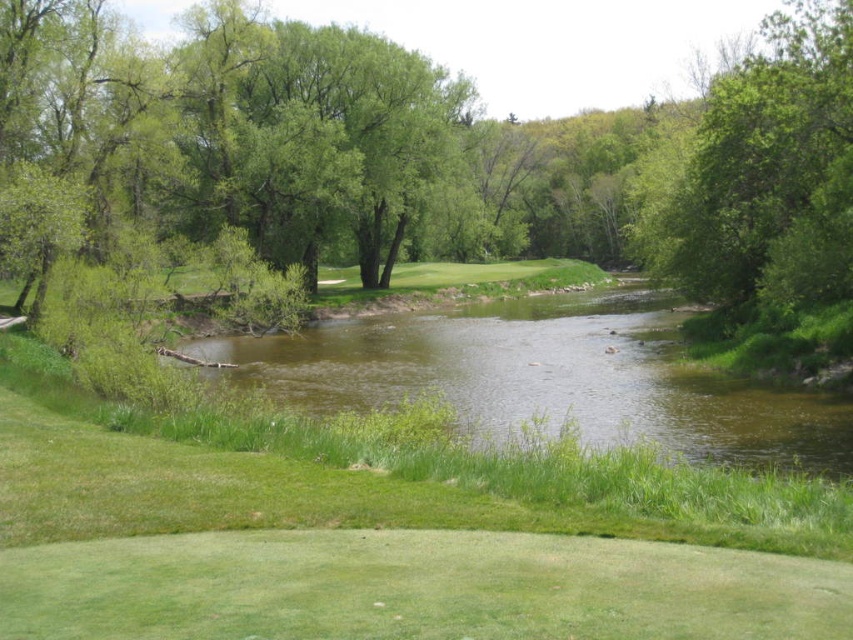
Question: Does green grassy golf course at center lie behind green leafy tree at upper right?

Choices:
 (A) no
 (B) yes

Answer: (A)

Question: Does green grassy golf course at center come in front of green leafy tree at upper right?

Choices:
 (A) no
 (B) yes

Answer: (B)

Question: Among these points, which one is farthest from the camera?

Choices:
 (A) tap(822, 202)
 (B) tap(115, 499)

Answer: (A)

Question: Can you confirm if green grassy golf course at center is bigger than green leafy tree at upper right?

Choices:
 (A) yes
 (B) no

Answer: (B)